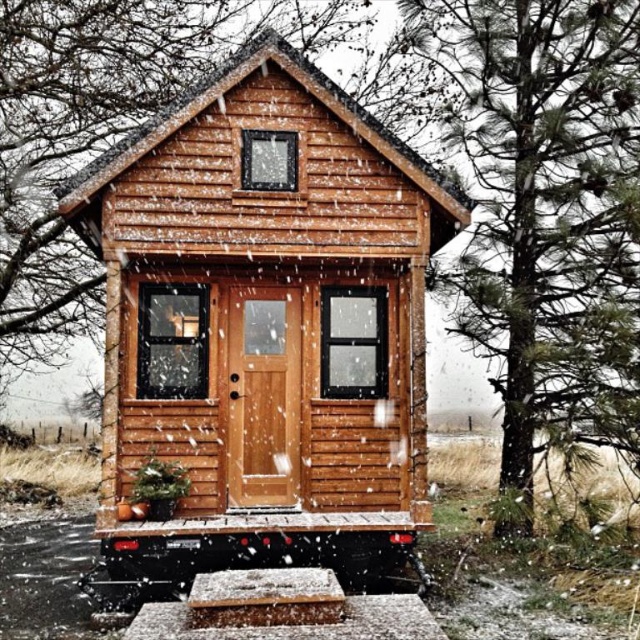
Question: Which point appears farthest from the camera in this image?

Choices:
 (A) (256, 140)
 (B) (552, 284)

Answer: (B)

Question: Among these points, which one is farthest from the camera?

Choices:
 (A) (412, 481)
 (B) (472, 166)

Answer: (B)

Question: Is matte wood log cabin at center positioned before green pine tree at right?

Choices:
 (A) no
 (B) yes

Answer: (B)

Question: Does matte wood log cabin at center appear over green pine tree at right?

Choices:
 (A) yes
 (B) no

Answer: (B)

Question: From the image, what is the correct spatial relationship of matte wood log cabin at center in relation to green pine tree at right?

Choices:
 (A) below
 (B) above

Answer: (A)

Question: Which point is farther to the camera?

Choices:
 (A) green pine tree at right
 (B) matte wood log cabin at center

Answer: (A)